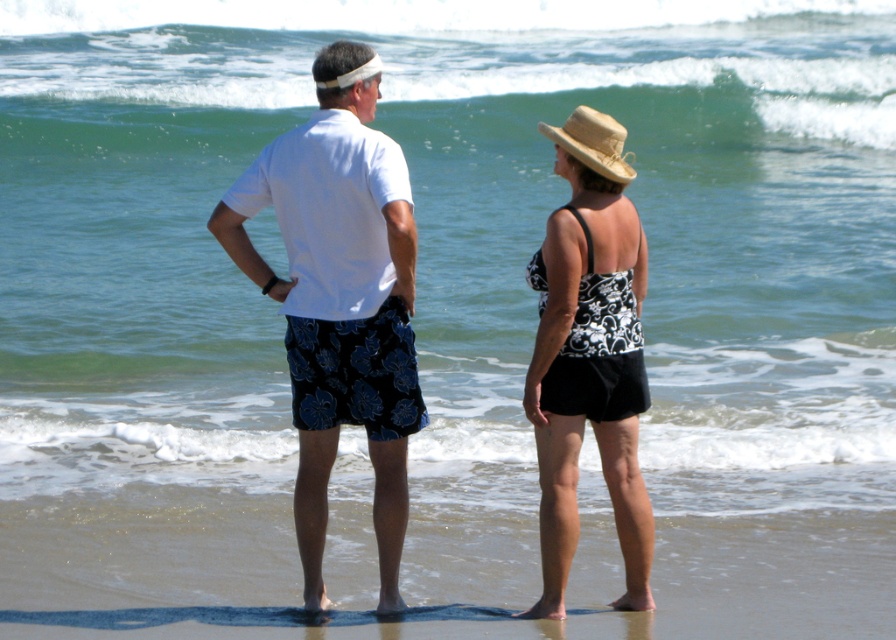
What do you see at coordinates (589, 355) in the screenshot? I see `black floral swimsuit at center` at bounding box center [589, 355].

Is black floral swimsuit at center below straw hat at upper right?

Correct, black floral swimsuit at center is located below straw hat at upper right.

What do you see at coordinates (589, 355) in the screenshot?
I see `black floral swimsuit at center` at bounding box center [589, 355].

Identify the location of black floral swimsuit at center. The image size is (896, 640). pos(589,355).

Can you confirm if white matte shirt at center is positioned to the right of black floral swimsuit at center?

No, white matte shirt at center is not to the right of black floral swimsuit at center.

Can you confirm if white matte shirt at center is thinner than black floral swimsuit at center?

In fact, white matte shirt at center might be wider than black floral swimsuit at center.

Where is `white matte shirt at center`? white matte shirt at center is located at coordinates (340, 298).

Where is `white matte shirt at center`? white matte shirt at center is located at coordinates (340, 298).

Does white cotton shirt at center appear under straw hat at upper right?

Yes, white cotton shirt at center is below straw hat at upper right.

The image size is (896, 640). I want to click on white cotton shirt at center, so click(x=340, y=298).